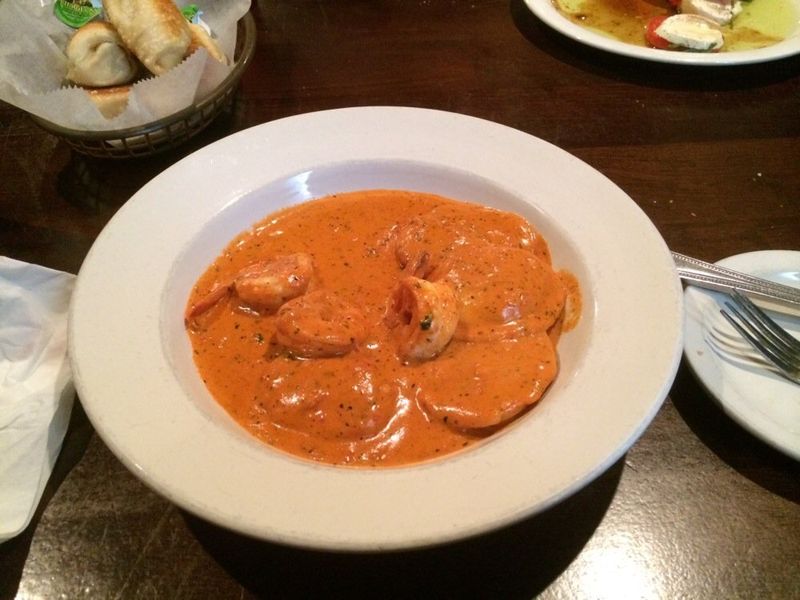
I want to click on small white plate, so click(x=770, y=403).